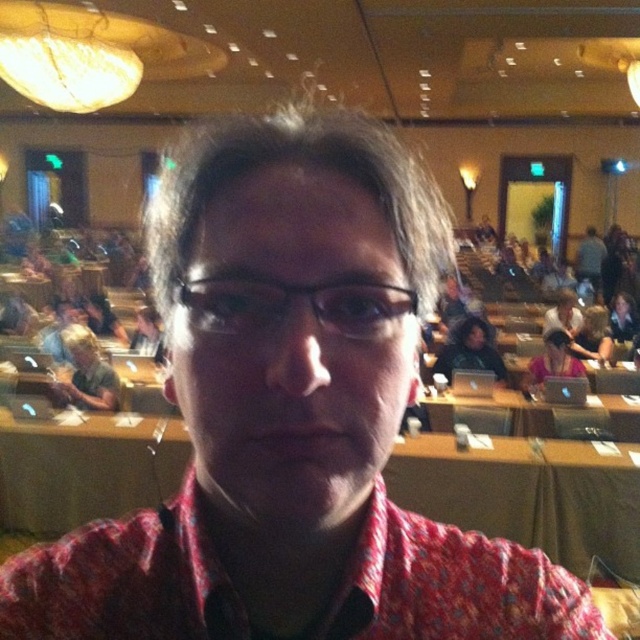
You are organizing a photo shoot and need to ensure that the black plastic glasses at center and the matte black laptop at upper right are positioned correctly. According to the scene, which object is located to the left of the other?

The black plastic glasses at center is to the left of the matte black laptop at upper right.

You are organizing a small workshop in this conference room and need to place a 1.2 meter wide whiteboard between the wooden table at center and the matte black laptop at upper right. Based on their widths, will the whiteboard fit between them?

The wooden table at center might be wider than matte black laptop at upper right, but since the exact width difference isn not provided, it is uncertain whether the 1.2 meter whiteboard will fit between them.

You are organizing a photo shoot and need to ensure that the black plastic glasses at center and the matte black laptop at upper right are both visible in the frame. Given their sizes, which object might require more careful positioning to avoid being overshadowed?

The black plastic glasses at center has a lesser height compared to matte black laptop at upper right, so it might require more careful positioning to avoid being overshadowed by the taller matte black laptop at upper right.